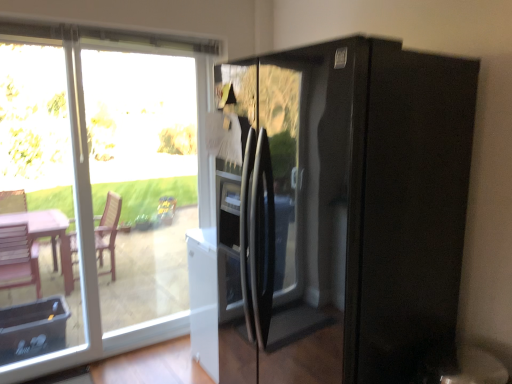
Where is `transparent glass door at left, which appears as the 2th glass door when viewed from the left`? This screenshot has width=512, height=384. transparent glass door at left, which appears as the 2th glass door when viewed from the left is located at coordinates (142, 178).

This screenshot has width=512, height=384. Find the location of `transparent glass door at left, the second glass door in the right-to-left sequence`. transparent glass door at left, the second glass door in the right-to-left sequence is located at coordinates (45, 212).

The height and width of the screenshot is (384, 512). What are the coordinates of `transparent glass door at left, which is the first glass door from right to left` in the screenshot? It's located at (142, 178).

In order to click on appliance that appears in front of the transparent glass window at upper left in this screenshot , I will do point(348,209).

Considering the sizes of transparent glass window at upper left and black glass refrigerator at right in the image, is transparent glass window at upper left wider or thinner than black glass refrigerator at right?

Clearly, transparent glass window at upper left has less width compared to black glass refrigerator at right.

From the image's perspective, between transparent glass window at upper left and black glass refrigerator at right, which one is located above?

transparent glass window at upper left appears higher in the image.

Which of these two, transparent glass window at upper left or black glass refrigerator at right, is smaller?

transparent glass window at upper left.

Are transparent glass door at left, the first glass door from the left, and transparent glass door at left, which is the first glass door from right to left, located far from each other?

No, transparent glass door at left, the first glass door from the left, is not far away from transparent glass door at left, which is the first glass door from right to left.

Considering the sizes of objects transparent glass door at left, the second glass door in the right-to-left sequence, and transparent glass door at left, which appears as the 2th glass door when viewed from the left, in the image provided, who is shorter, transparent glass door at left, the second glass door in the right-to-left sequence, or transparent glass door at left, which appears as the 2th glass door when viewed from the left,?

transparent glass door at left, the second glass door in the right-to-left sequence.

Is transparent glass door at left, the second glass door in the right-to-left sequence, oriented away from transparent glass door at left, which appears as the 2th glass door when viewed from the left?

No, transparent glass door at left, the second glass door in the right-to-left sequence,'s orientation is not away from transparent glass door at left, which appears as the 2th glass door when viewed from the left.

Looking at this image, which of these two, black glass refrigerator at right or transparent glass door at left, which appears as the 2th glass door when viewed from the left, is bigger?

Bigger between the two is black glass refrigerator at right.

Could you tell me if black glass refrigerator at right is facing transparent glass door at left, which is the first glass door from right to left?

No.

Does black glass refrigerator at right appear on the left side of transparent glass door at left, which is the first glass door from right to left?

No.

Can you tell me how much black glass refrigerator at right and transparent glass door at left, which appears as the 2th glass door when viewed from the left, differ in facing direction?

The facing directions of black glass refrigerator at right and transparent glass door at left, which appears as the 2th glass door when viewed from the left, are 91.3 degrees apart.

How far apart are transparent glass door at left, which is the first glass door from right to left, and black glass refrigerator at right?

transparent glass door at left, which is the first glass door from right to left, is 1.59 meters away from black glass refrigerator at right.

You are a GUI agent. You are given a task and a screenshot of the screen. Output one action in this format:
    pyautogui.click(x=<x>, y=<y>)
    Task: Click on the 2nd glass door positioned above the black glass refrigerator at right (from the image's perspective)
    The height and width of the screenshot is (384, 512).
    Given the screenshot: What is the action you would take?
    pyautogui.click(x=142, y=178)

Is transparent glass door at left, which appears as the 2th glass door when viewed from the left, in contact with black glass refrigerator at right?

No.

From the image's perspective, would you say transparent glass door at left, which appears as the 2th glass door when viewed from the left, is shown under black glass refrigerator at right?

No, from the image's perspective, transparent glass door at left, which appears as the 2th glass door when viewed from the left, is not below black glass refrigerator at right.

Is transparent glass window at upper left at the back of transparent glass door at left, which appears as the 2th glass door when viewed from the left?

Result: Yes, transparent glass door at left, which appears as the 2th glass door when viewed from the left,'s orientation is away from transparent glass window at upper left.

Which of these two, transparent glass door at left, which appears as the 2th glass door when viewed from the left, or transparent glass window at upper left, stands taller?

Standing taller between the two is transparent glass window at upper left.

Which of these two, transparent glass door at left, which appears as the 2th glass door when viewed from the left, or transparent glass window at upper left, is smaller?

transparent glass door at left, which appears as the 2th glass door when viewed from the left.

From the image's perspective, is transparent glass door at left, which is the first glass door from right to left, beneath transparent glass window at upper left?

No, from the image's perspective, transparent glass door at left, which is the first glass door from right to left, is not beneath transparent glass window at upper left.

Is transparent glass window at upper left to the left or to the right of transparent glass door at left, which appears as the 2th glass door when viewed from the left, in the image?

From the image, it's evident that transparent glass window at upper left is to the left of transparent glass door at left, which appears as the 2th glass door when viewed from the left.

From their relative heights in the image, would you say transparent glass window at upper left is taller or shorter than transparent glass door at left, which appears as the 2th glass door when viewed from the left?

Considering their sizes, transparent glass window at upper left has more height than transparent glass door at left, which appears as the 2th glass door when viewed from the left.

Consider the image. Who is bigger, transparent glass window at upper left or transparent glass door at left, which appears as the 2th glass door when viewed from the left?

transparent glass window at upper left.

How far apart are transparent glass window at upper left and transparent glass door at left, the second glass door in the right-to-left sequence?

A distance of 8.86 inches exists between transparent glass window at upper left and transparent glass door at left, the second glass door in the right-to-left sequence.

From a real-world perspective, which object stands above the other?

transparent glass door at left, the first glass door from the left, is physically above.

In the image, is transparent glass window at upper left positioned in front of or behind transparent glass door at left, the first glass door from the left?

transparent glass window at upper left is positioned farther from the viewer than transparent glass door at left, the first glass door from the left.

Where is `glass door that is in front of the transparent glass window at upper left`? glass door that is in front of the transparent glass window at upper left is located at coordinates (45, 212).

You are a GUI agent. You are given a task and a screenshot of the screen. Output one action in this format:
    pyautogui.click(x=<x>, y=<y>)
    Task: Click on the window on the left of black glass refrigerator at right
    
    Given the screenshot: What is the action you would take?
    pyautogui.click(x=98, y=188)

You are a GUI agent. You are given a task and a screenshot of the screen. Output one action in this format:
    pyautogui.click(x=<x>, y=<y>)
    Task: Click on the glass door lying below the transparent glass door at left, which is the first glass door from right to left (from the image's perspective)
    
    Given the screenshot: What is the action you would take?
    pyautogui.click(x=45, y=212)

From the picture: Which object lies further to the anchor point transparent glass door at left, the second glass door in the right-to-left sequence, transparent glass window at upper left or black glass refrigerator at right?

black glass refrigerator at right is positioned further to the anchor transparent glass door at left, the second glass door in the right-to-left sequence.

When comparing their distances from black glass refrigerator at right, does transparent glass door at left, the first glass door from the left, or transparent glass window at upper left seem closer?

transparent glass window at upper left.

From the image, which object appears to be nearer to transparent glass door at left, which is the first glass door from right to left, transparent glass window at upper left or transparent glass door at left, the first glass door from the left?

transparent glass window at upper left is positioned closer to the anchor transparent glass door at left, which is the first glass door from right to left.

Estimate the real-world distances between objects in this image. Which object is further from transparent glass window at upper left, transparent glass door at left, the first glass door from the left, or transparent glass door at left, which appears as the 2th glass door when viewed from the left?

Based on the image, transparent glass door at left, the first glass door from the left, appears to be further to transparent glass window at upper left.

From the image, which object appears to be nearer to transparent glass door at left, which is the first glass door from right to left, transparent glass door at left, the first glass door from the left, or transparent glass window at upper left?

transparent glass window at upper left is positioned closer to the anchor transparent glass door at left, which is the first glass door from right to left.

Which object lies further to the anchor point transparent glass window at upper left, black glass refrigerator at right or transparent glass door at left, the first glass door from the left?

black glass refrigerator at right is positioned further to the anchor transparent glass window at upper left.

Looking at the image, which one is located closer to transparent glass door at left, which appears as the 2th glass door when viewed from the left, black glass refrigerator at right or transparent glass window at upper left?

transparent glass window at upper left is closer to transparent glass door at left, which appears as the 2th glass door when viewed from the left.

Looking at this image, based on their spatial positions, is transparent glass window at upper left or transparent glass door at left, the first glass door from the left, closer to black glass refrigerator at right?

The object closer to black glass refrigerator at right is transparent glass window at upper left.

Where is `glass door situated between transparent glass window at upper left and black glass refrigerator at right from left to right`? The width and height of the screenshot is (512, 384). glass door situated between transparent glass window at upper left and black glass refrigerator at right from left to right is located at coordinates (142, 178).

The height and width of the screenshot is (384, 512). I want to click on glass door between transparent glass door at left, the second glass door in the right-to-left sequence, and black glass refrigerator at right, so click(x=142, y=178).

Where is `window located between transparent glass door at left, the first glass door from the left, and black glass refrigerator at right in the left-right direction`? The image size is (512, 384). window located between transparent glass door at left, the first glass door from the left, and black glass refrigerator at right in the left-right direction is located at coordinates (98, 188).

Image resolution: width=512 pixels, height=384 pixels. Identify the location of window between transparent glass door at left, the second glass door in the right-to-left sequence, and transparent glass door at left, which is the first glass door from right to left, from left to right. (98, 188).